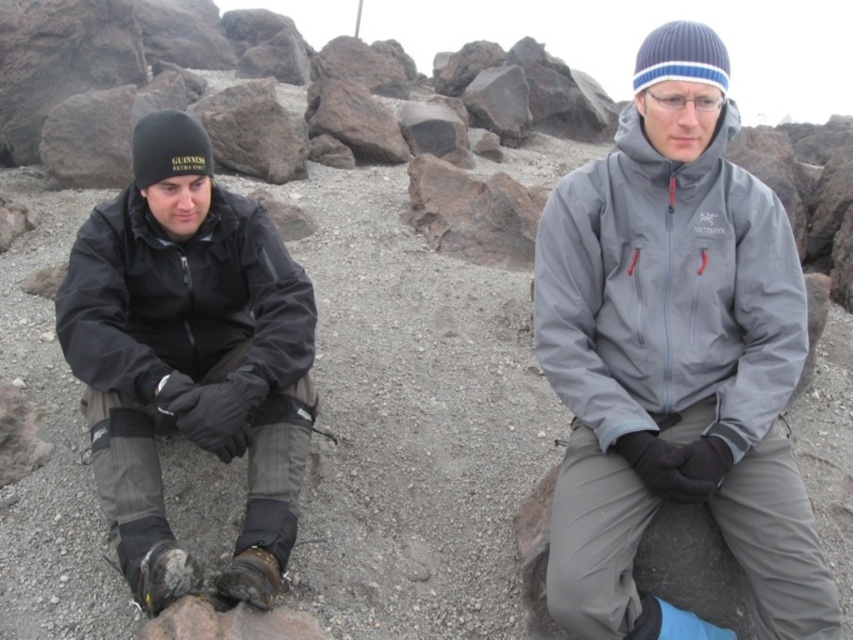
Question: Can you confirm if gray softshell jacket at center is smaller than black matte jacket at left?

Choices:
 (A) no
 (B) yes

Answer: (B)

Question: Is gray softshell jacket at center positioned at the back of black matte jacket at left?

Choices:
 (A) yes
 (B) no

Answer: (B)

Question: Among these objects, which one is nearest to the camera?

Choices:
 (A) gray softshell jacket at center
 (B) black matte jacket at left

Answer: (A)

Question: Is gray softshell jacket at center bigger than black matte jacket at left?

Choices:
 (A) yes
 (B) no

Answer: (B)

Question: Among these points, which one is nearest to the camera?

Choices:
 (A) (235, 241)
 (B) (703, 467)

Answer: (B)